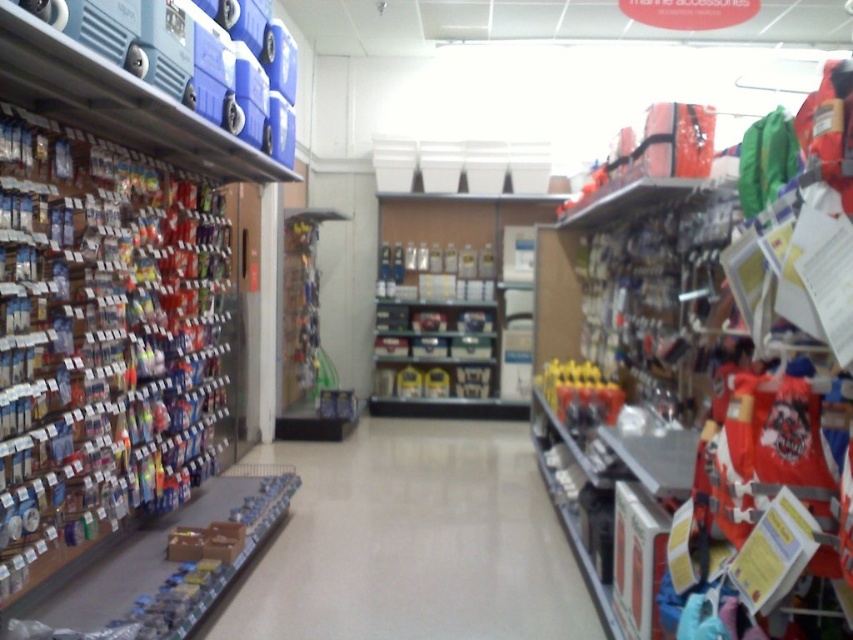
Question: Which point appears farthest from the camera in this image?

Choices:
 (A) pyautogui.click(x=573, y=392)
 (B) pyautogui.click(x=325, y=460)

Answer: (B)

Question: Which object is farther from the camera taking this photo?

Choices:
 (A) metallic silver canisters at center
 (B) white glossy floor at center

Answer: (A)

Question: Is white glossy floor at center behind metallic silver canisters at center?

Choices:
 (A) no
 (B) yes

Answer: (A)

Question: In this image, where is white glossy floor at center located relative to metallic silver canisters at center?

Choices:
 (A) right
 (B) left

Answer: (B)

Question: Does white glossy floor at center have a lesser width compared to metallic silver canisters at center?

Choices:
 (A) yes
 (B) no

Answer: (B)